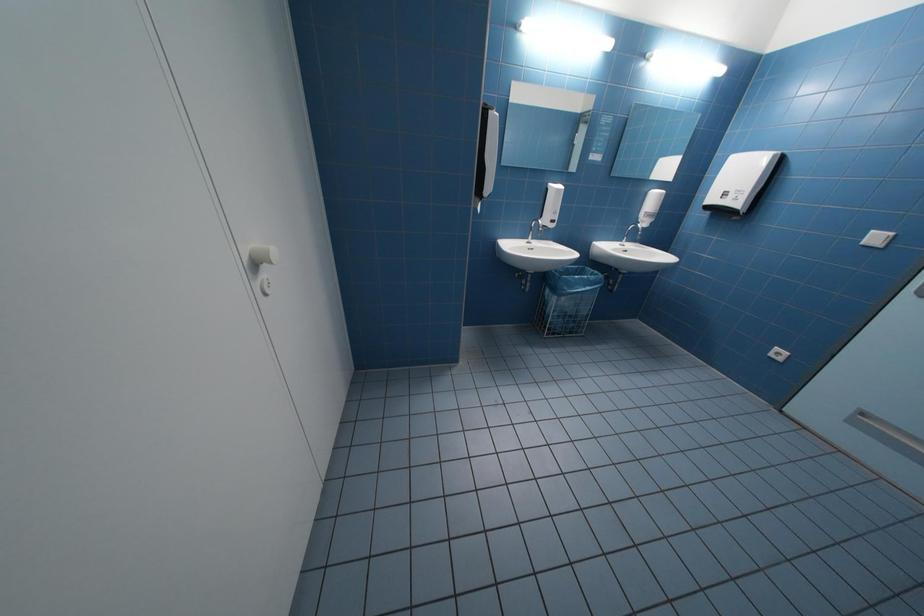
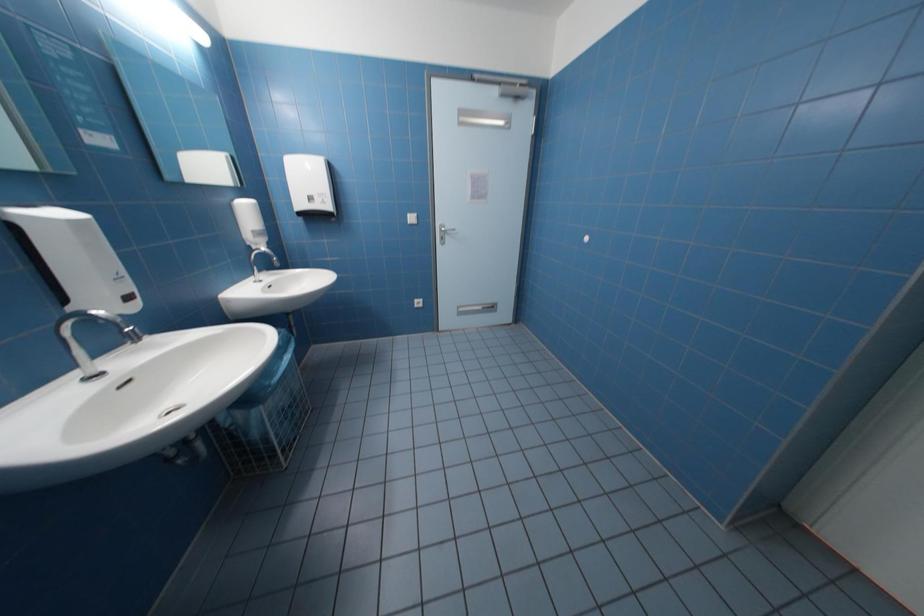
Based on the photo, based on the continuous images, in which direction is the camera rotating?

The rotation direction of the camera is right-down.